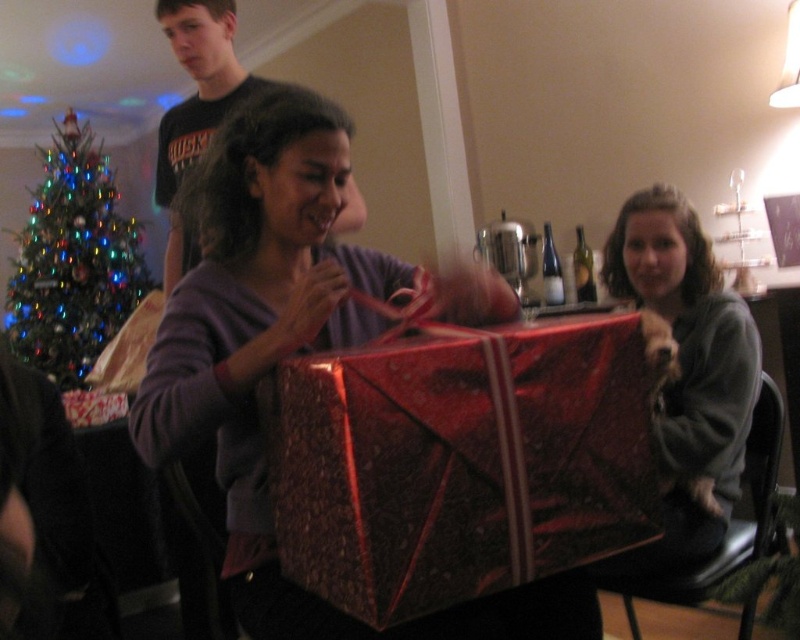
You are standing at the center of the room and want to reach the gray fleece sweater at right. Based on the coordinates provided, in which direction should you move from your current position to get there?

The gray fleece sweater at right is located at coordinates point (686,372), so you should move towards the right side of the room to reach it.

You are a guest at a holiday party and see the gray fleece sweater at right and the green glittering christmas tree at left. Which object is closer to the floor?

The gray fleece sweater at right is closer to the floor because it is positioned under the green glittering christmas tree at left.